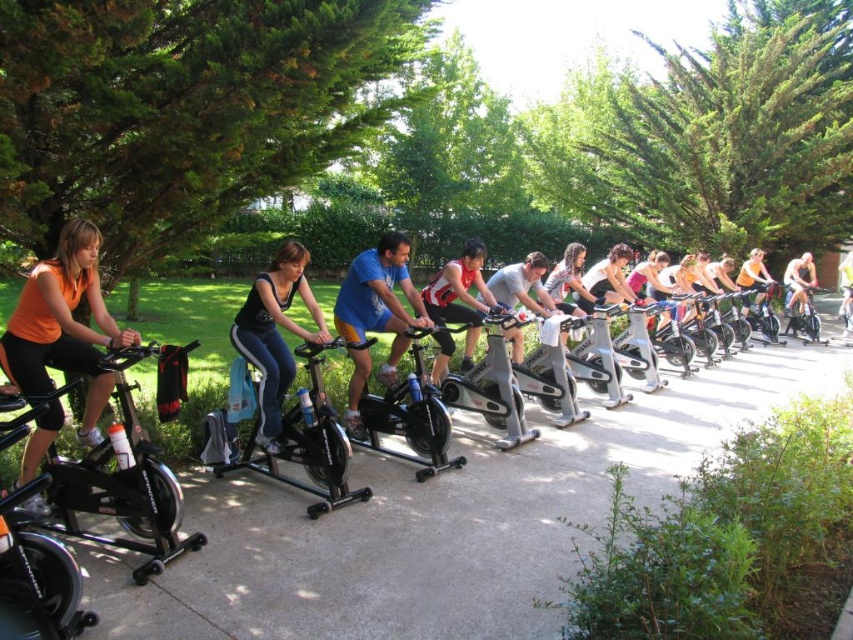
Is point (769, 308) closer to camera compared to point (805, 292)?

Yes.

In the scene shown: Which is more to the left, shiny metallic bicycle at center or light blue fabric shirt at center?

shiny metallic bicycle at center is more to the left.

Find the location of a particular element. This screenshot has width=853, height=640. shiny metallic bicycle at center is located at coordinates (759, 308).

Between point (268, 314) and point (506, 285), which one is positioned in front?

Point (268, 314)

Is point (270, 353) farther from viewer compared to point (511, 284)?

No, it is not.

What are the coordinates of `matte black tank top at center` in the screenshot? It's located at (276, 332).

Looking at this image, does black matte exercise bike at center appear under blue fabric shirt at center?

Yes.

Who is positioned more to the right, black matte exercise bike at center or blue fabric shirt at center?

blue fabric shirt at center is more to the right.

You are a GUI agent. You are given a task and a screenshot of the screen. Output one action in this format:
    pyautogui.click(x=<x>, y=<y>)
    Task: Click on the black matte exercise bike at center
    Image resolution: width=853 pixels, height=640 pixels.
    Given the screenshot: What is the action you would take?
    click(297, 442)